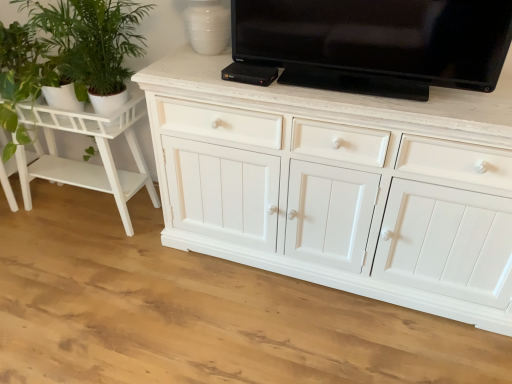
Image resolution: width=512 pixels, height=384 pixels. I want to click on free spot below white painted wood side table at left (from a real-world perspective), so click(93, 208).